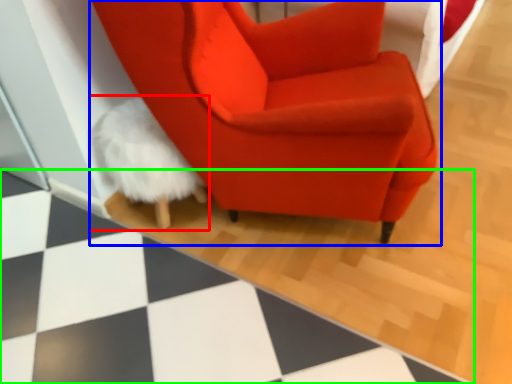
Question: Which object is positioned closest to bean bag chair (highlighted by a red box)? Select from chair (highlighted by a blue box) and tile (highlighted by a green box).

Choices:
 (A) chair
 (B) tile

Answer: (A)